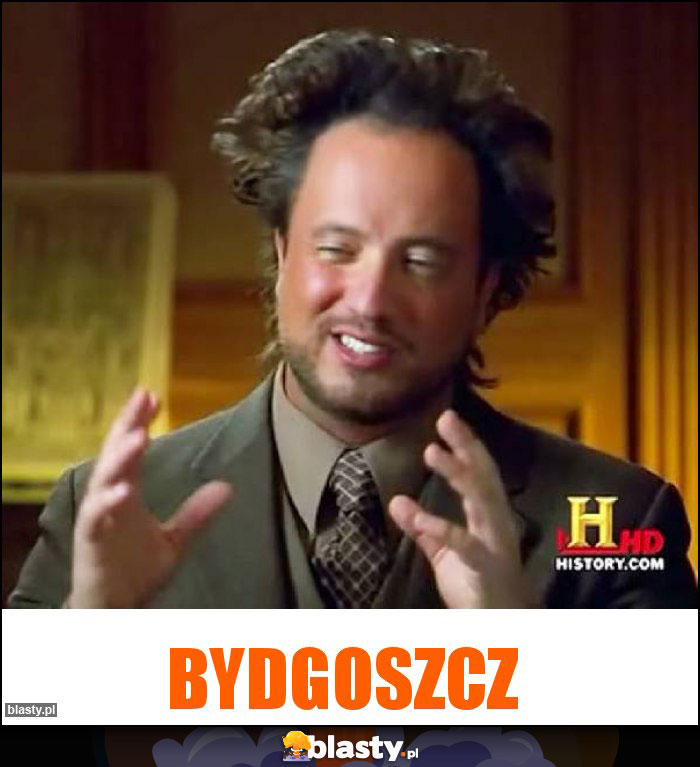
I want to click on wooden wall/background, so click(x=582, y=308).